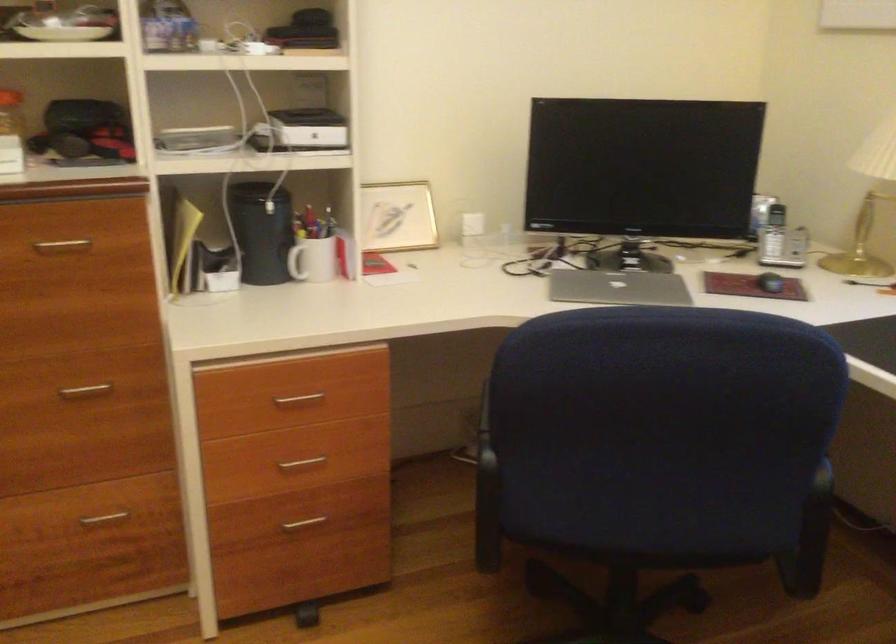
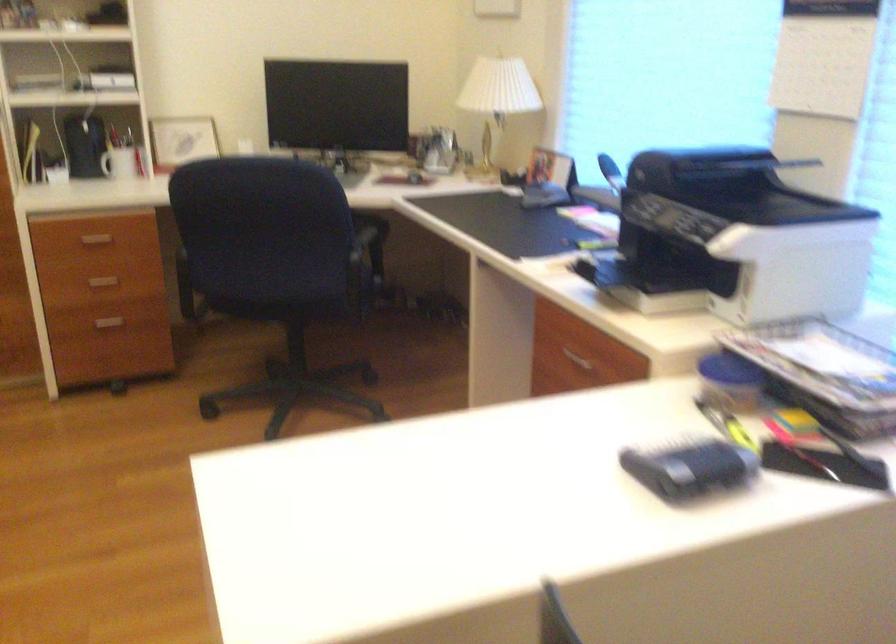
The images are taken continuously from a first-person perspective. In which direction are you moving?

The cameraman moved toward right, backward.